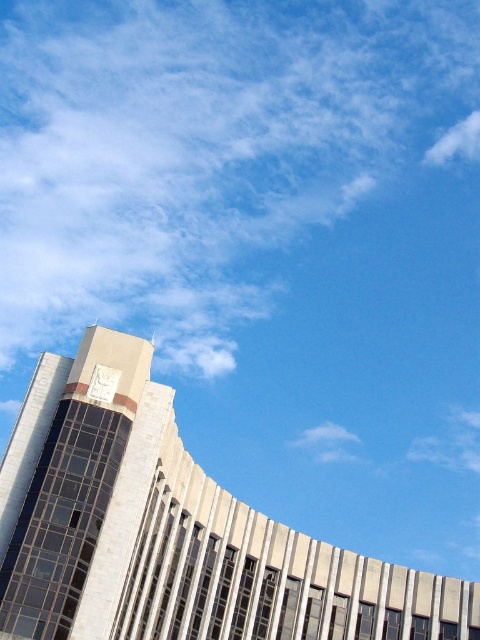
Question: Is white stone tower at upper left positioned at the back of metallic clock at upper left?

Choices:
 (A) no
 (B) yes

Answer: (A)

Question: Is white stone tower at upper left above white fluffy cloud at upper right?

Choices:
 (A) no
 (B) yes

Answer: (A)

Question: Where is white stone tower at upper left located in relation to metallic clock at upper left in the image?

Choices:
 (A) left
 (B) right

Answer: (B)

Question: Considering the real-world distances, which object is closest to the metallic clock at upper left?

Choices:
 (A) white fluffy cloud at upper right
 (B) white fluffy cloud at upper center

Answer: (B)

Question: Which object is closer to the camera taking this photo?

Choices:
 (A) white stone tower at upper left
 (B) metallic clock at upper left

Answer: (A)

Question: Which point is farther to the camera?

Choices:
 (A) white fluffy cloud at upper right
 (B) metallic clock at upper left

Answer: (A)